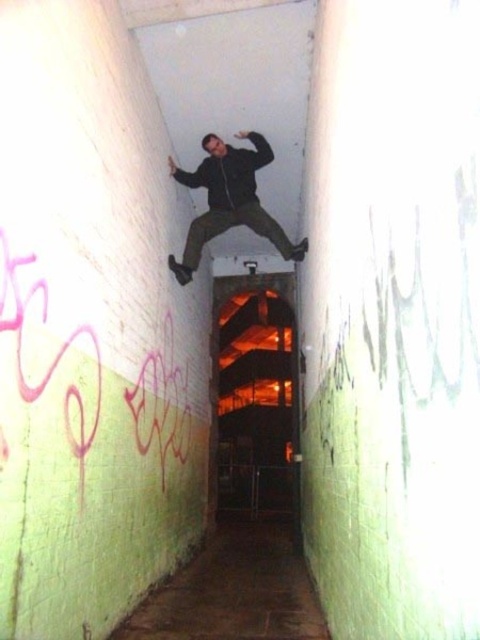
Can you confirm if pink graffiti at left is positioned above matte black jacket at center?

No, pink graffiti at left is not above matte black jacket at center.

Can you confirm if pink graffiti at left is smaller than matte black jacket at center?

Indeed, pink graffiti at left has a smaller size compared to matte black jacket at center.

Measure the distance between pink graffiti at left and camera.

pink graffiti at left is 2.31 meters from camera.

The width and height of the screenshot is (480, 640). Identify the location of pink graffiti at left. (x=50, y=352).